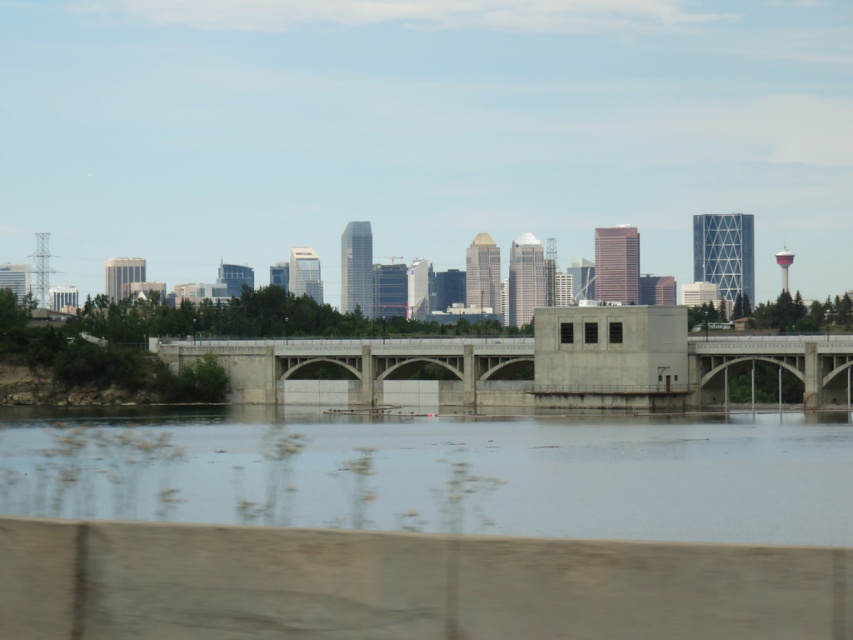
Question: Considering the relative positions of clear water at center and concrete bridge at center in the image provided, where is clear water at center located with respect to concrete bridge at center?

Choices:
 (A) right
 (B) left

Answer: (A)

Question: Which object is closer to the camera taking this photo?

Choices:
 (A) concrete bridge at center
 (B) clear water at center

Answer: (B)

Question: Where is clear water at center located in relation to concrete bridge at center in the image?

Choices:
 (A) below
 (B) above

Answer: (B)

Question: Which of the following is the farthest from the observer?

Choices:
 (A) concrete bridge at center
 (B) clear water at center

Answer: (A)

Question: Is clear water at center below concrete bridge at center?

Choices:
 (A) yes
 (B) no

Answer: (B)

Question: Which object appears farthest from the camera in this image?

Choices:
 (A) concrete bridge at center
 (B) clear water at center

Answer: (A)